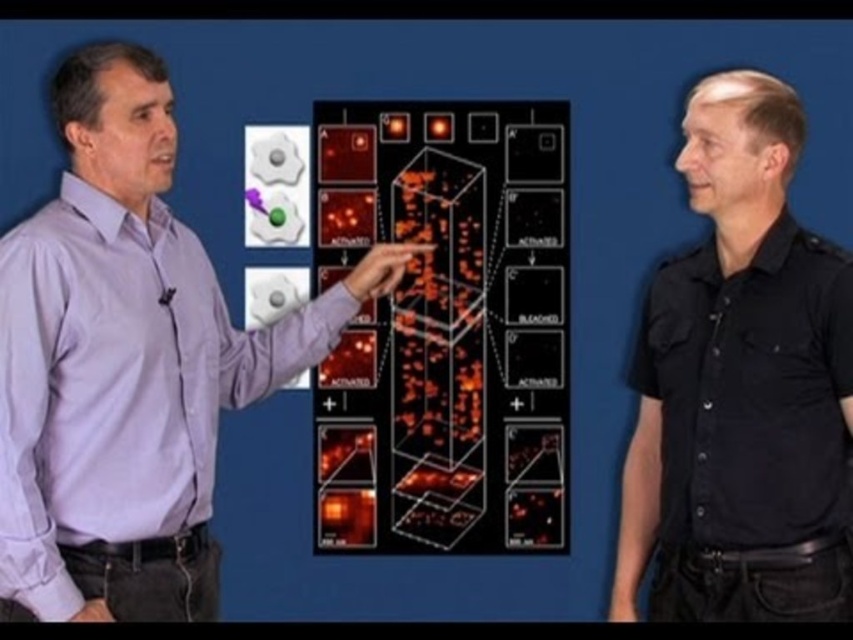
Where is the purple shirt at center located in the image?

The purple shirt at center is located at point (128, 364) in the image.

Based on the photo, you are standing in front of the diagram and want to touch the point at coordinates point (117, 296). If your arm can reach up to 2 meters, can you reach it?

The distance of point (117, 296) from camera is 2.18 meters, so your arm cannot reach it since it is further away than 2 meters.

You are a photographer adjusting the focus on your camera. You want to ensure both the point at [181,241] and the point at [814,323] are in focus. Which point should you focus on first to achieve this?

You should focus on the point at [181,241] first because it is closer to the camera than the point at [814,323]. This ensures the depth of field will cover both points effectively.